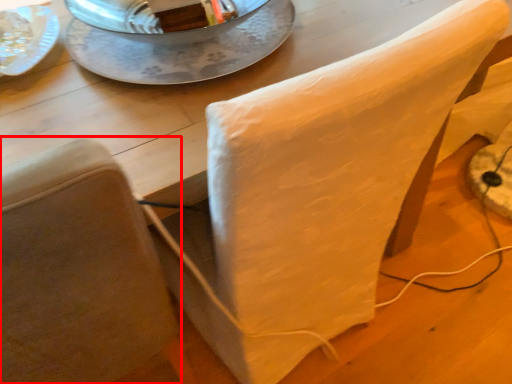
Question: From the image, what is the correct spatial relationship of chair (annotated by the red box) in relation to glass plate?

Choices:
 (A) right
 (B) left

Answer: (B)